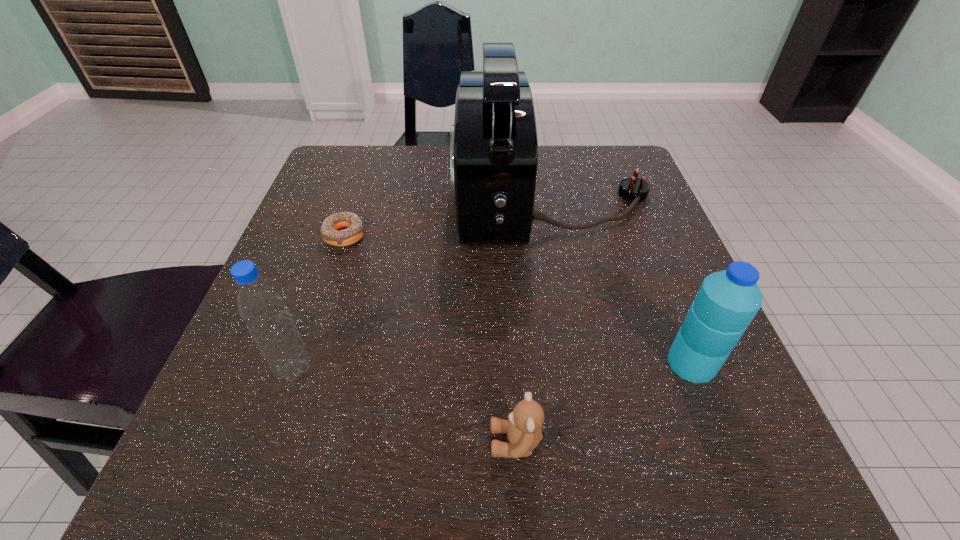
The image size is (960, 540). Identify the location of water bottle positioned at the right edge. (727, 301).

Identify the location of object present at the far right corner. This screenshot has height=540, width=960. (493, 144).

Where is `free location at the far edge of the desktop`? The height and width of the screenshot is (540, 960). free location at the far edge of the desktop is located at coordinates (404, 172).

Where is `vacant space at the near edge of the desktop`? vacant space at the near edge of the desktop is located at coordinates (336, 465).

The height and width of the screenshot is (540, 960). What are the coordinates of `vacant region at the left edge` in the screenshot? It's located at (372, 247).

You are a GUI agent. You are given a task and a screenshot of the screen. Output one action in this format:
    pyautogui.click(x=<x>, y=<y>)
    Task: Click on the free space at the right edge
    The image size is (960, 540).
    Given the screenshot: What is the action you would take?
    pyautogui.click(x=595, y=218)

Locate an element on the screen. free spot at the far left corner of the desktop is located at coordinates (350, 157).

In order to click on vacant space at the far right corner of the desktop in this screenshot , I will do `click(588, 148)`.

Where is `free point at the near right corner`? The height and width of the screenshot is (540, 960). free point at the near right corner is located at coordinates (677, 452).

Identify the location of free space that is in between the left water bottle and the radio receiver. (422, 283).